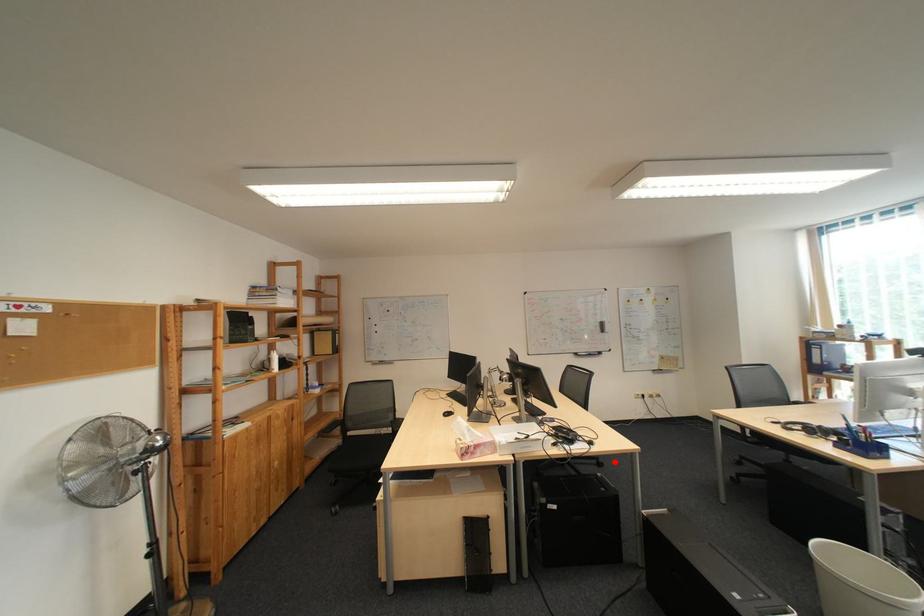
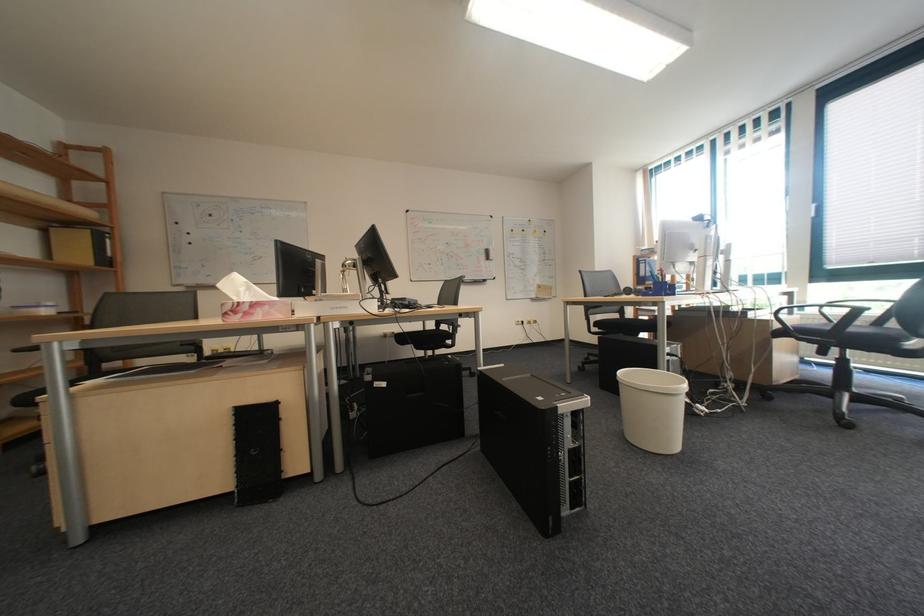
Question: I am providing you with two images of the same scene from different viewpoints. A red point is shown in image1. For the corresponding object point in image2, is it positioned nearer or farther from the camera?

Choices:
 (A) Nearer
 (B) Farther

Answer: (A)